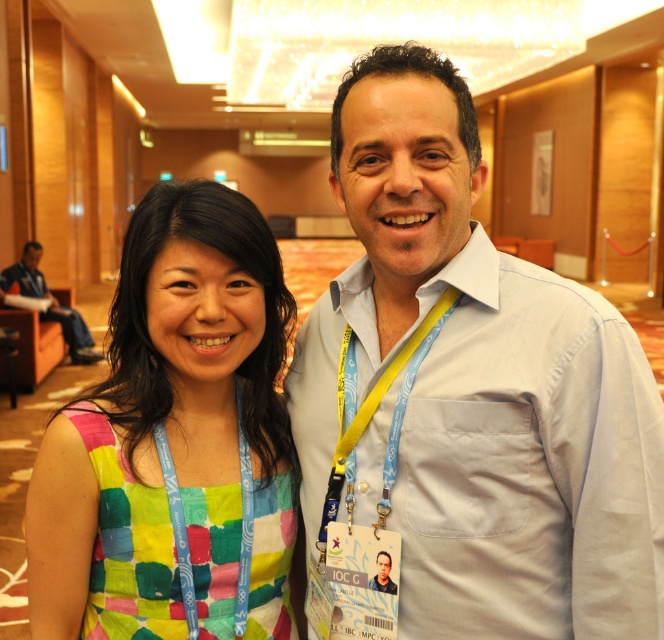
You are at a conference and need to locate the registration desk. You see a white cotton shirt at center and a yellow fabric lanyard at center. Which object is positioned more to the right?

The white cotton shirt at center is to the right of the yellow fabric lanyard at center, so the white cotton shirt at center is positioned more to the right.

What are the coordinates of the patchwork fabric dress at center?

The coordinates of the patchwork fabric dress at center are at point (173, 440).

You are a photographer at the event and need to adjust your camera focus to the white cotton shirt at center. What are the coordinates you should set?

The white cotton shirt at center is located at coordinates point (475, 388), so set the camera focus to those coordinates.